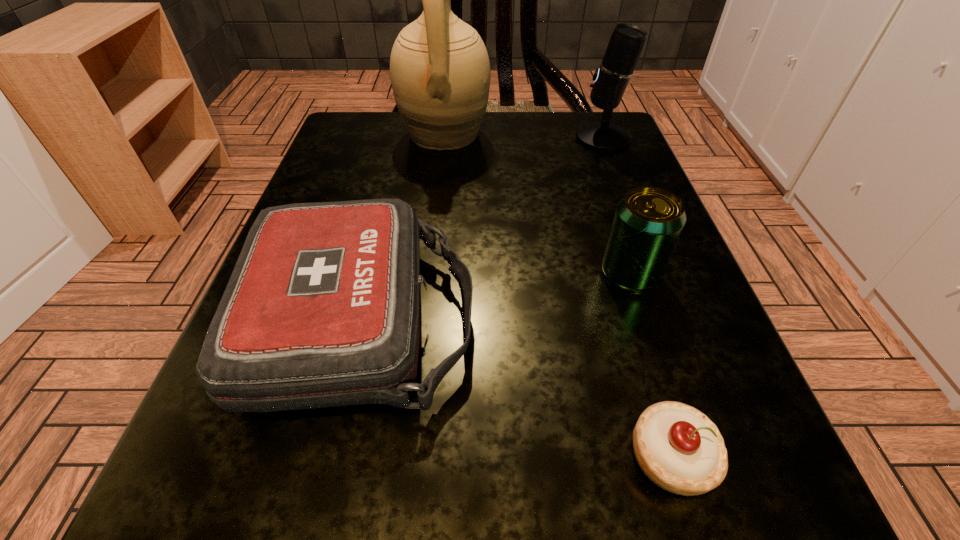
In order to click on free point that satisfies the following two spatial constraints: 1. on the back side of the second tallest object; 2. on the right side of the first-aid kit in this screenshot , I will do `click(403, 138)`.

Locate an element on the screen. vacant space that satisfies the following two spatial constraints: 1. on the front side of the tallest object; 2. on the right side of the pastry is located at coordinates pos(408,457).